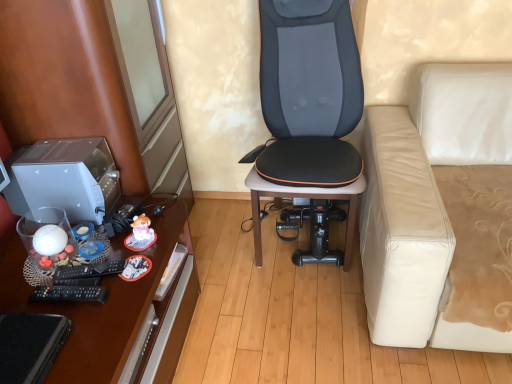
Where is `empty space that is ontop of brown wooden desk at left (from a real-world perspective)`? Image resolution: width=512 pixels, height=384 pixels. empty space that is ontop of brown wooden desk at left (from a real-world perspective) is located at coordinates (72, 270).